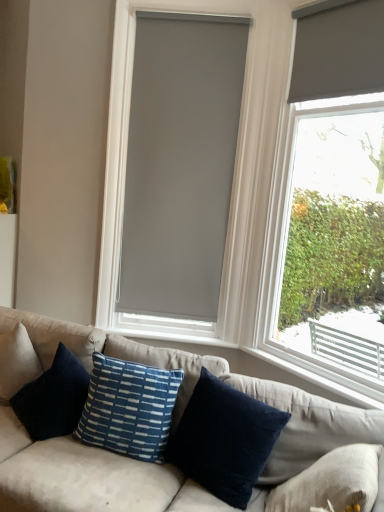
Question: Is white plastic window sill at lower right taller or shorter than navy blue cotton pillow at center, marked as the first pillow in a right-to-left arrangement?

Choices:
 (A) tall
 (B) short

Answer: (B)

Question: Is white plastic window sill at lower right in front of or behind navy blue cotton pillow at center, marked as the first pillow in a right-to-left arrangement, in the image?

Choices:
 (A) front
 (B) behind

Answer: (B)

Question: Which is nearer to the velvet blue pillows at center?

Choices:
 (A) blue textured pillow at center, the second pillow when ordered from right to left
 (B) gray matte blind at center, marked as the second window blind in a front-to-back arrangement
 (C) white plastic window sill at lower right
 (D) navy blue cotton pillow at center, marked as the first pillow in a right-to-left arrangement
 (E) matte gray roller blind at right

Answer: (D)

Question: Which object is the farthest from the navy blue cotton pillow at center, marked as the first pillow in a right-to-left arrangement?

Choices:
 (A) blue textured pillow at center, which is counted as the first pillow, starting from the left
 (B) white plastic window sill at lower right
 (C) matte gray roller blind at upper right, arranged as the second window blind when viewed from the left
 (D) velvet blue pillows at center
 (E) gray matte blind at center, placed as the first window blind when sorted from left to right

Answer: (C)